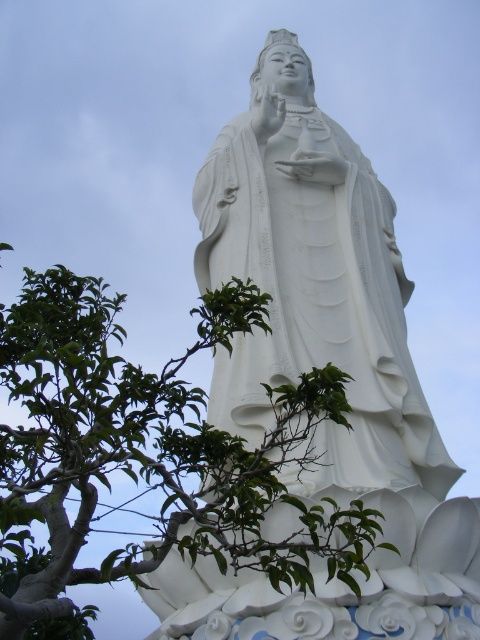
Between point (51, 371) and point (380, 360), which one is positioned behind?

Point (380, 360)

Between point (54, 417) and point (216, 152), which one is positioned behind?

The point (216, 152) is more distant.

I want to click on green leafy tree at center, so click(x=146, y=456).